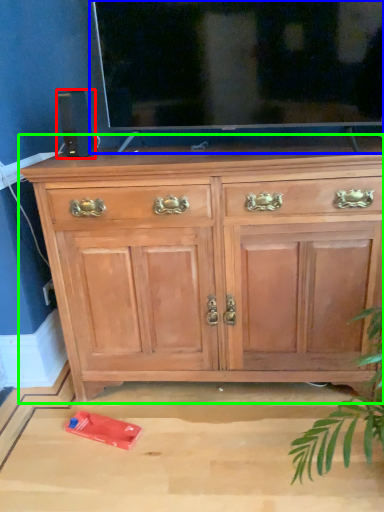
Question: Which is farther away from speaker (highlighted by a red box)? glass door (highlighted by a blue box) or chest of drawers (highlighted by a green box)?

Choices:
 (A) glass door
 (B) chest of drawers

Answer: (B)